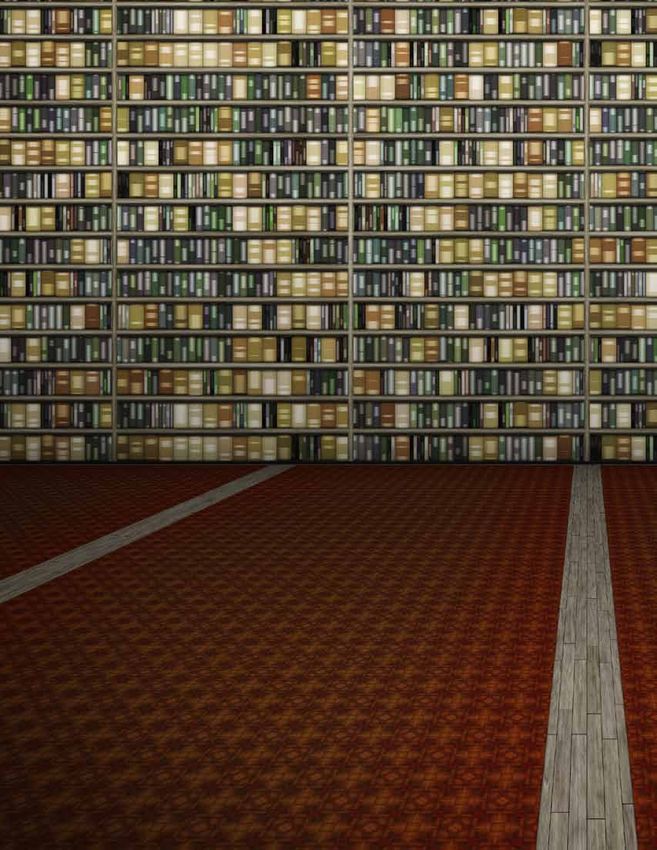
You are a GUI agent. You are given a task and a screenshot of the screen. Output one action in this format:
    pyautogui.click(x=<x>, y=<y>)
    Task: Click on the red patterned carpet in the library
    
    Given the screenshot: What is the action you would take?
    pyautogui.click(x=637, y=505), pyautogui.click(x=403, y=661), pyautogui.click(x=68, y=479), pyautogui.click(x=332, y=494)